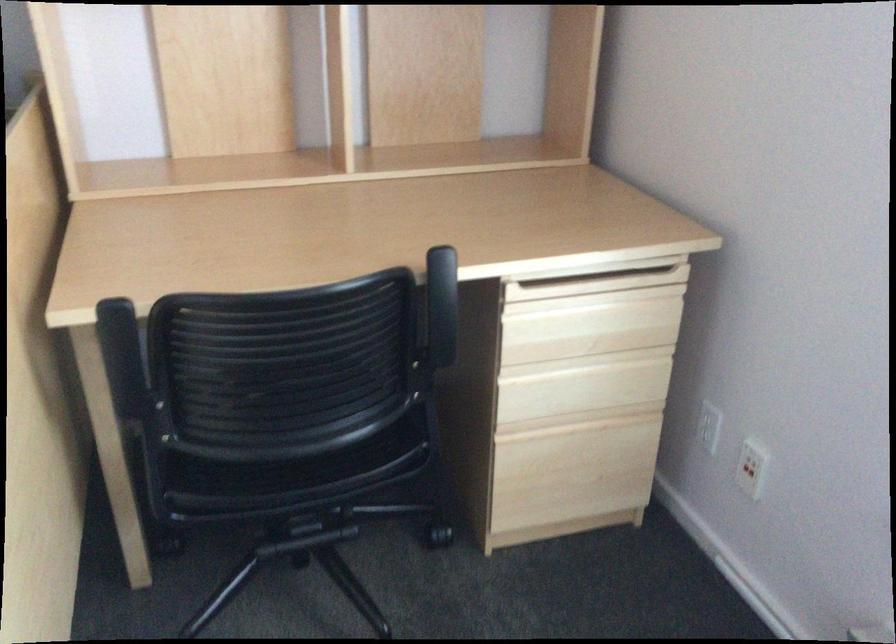
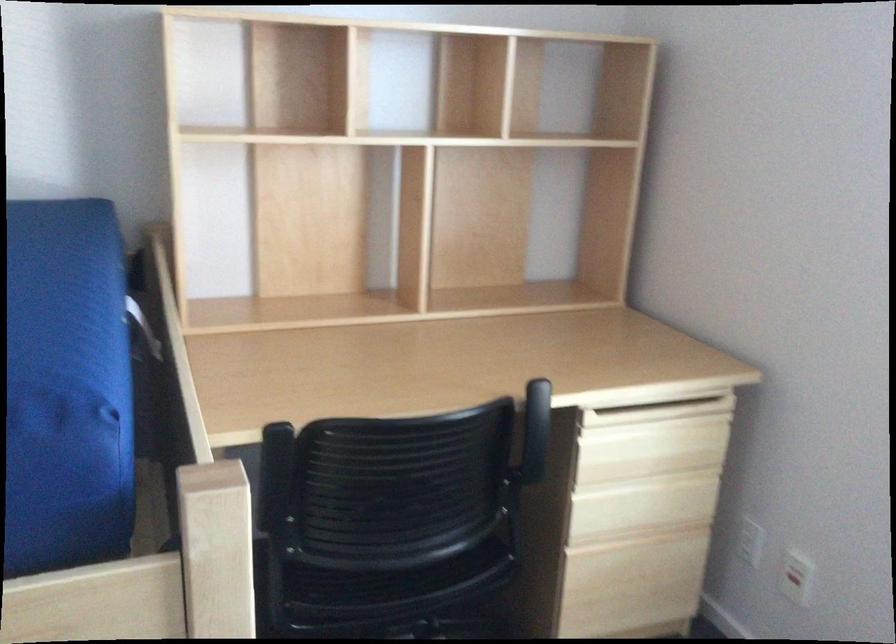
Find the pixel in the second image that matches point 589,325 in the first image.

(650, 448)